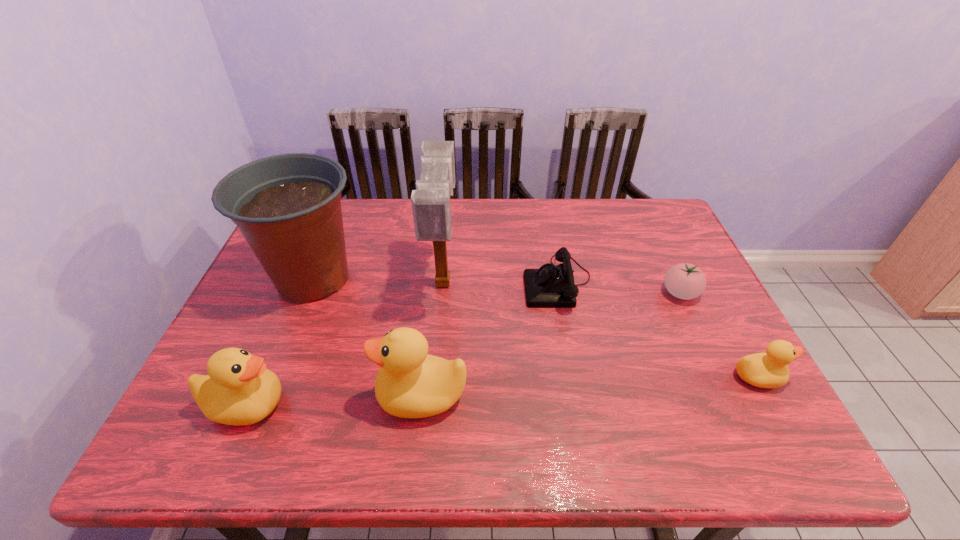
Find the location of a particular element. This screenshot has width=960, height=540. duck positioned at the right edge is located at coordinates (764, 370).

Identify the location of tomato located in the right edge section of the desktop. (686, 281).

Find the location of a particular element. The width and height of the screenshot is (960, 540). object at the near left corner is located at coordinates (238, 390).

Find the location of a particular element. object that is positioned at the near right corner is located at coordinates (764, 370).

This screenshot has width=960, height=540. I want to click on free space at the far edge, so 467,201.

You are a GUI agent. You are given a task and a screenshot of the screen. Output one action in this format:
    pyautogui.click(x=<x>, y=<y>)
    Task: Click on the vacant space at the left edge
    The height and width of the screenshot is (540, 960).
    Given the screenshot: What is the action you would take?
    pyautogui.click(x=279, y=366)

Where is `free space at the right edge of the desktop`? free space at the right edge of the desktop is located at coordinates (668, 255).

Find the location of a particular element. This screenshot has height=540, width=960. vacant space at the far left corner of the desktop is located at coordinates (343, 198).

Locate an element on the screen. The height and width of the screenshot is (540, 960). free space at the far right corner of the desktop is located at coordinates (632, 237).

Identify the location of free space at the near right corner of the desktop. (730, 411).